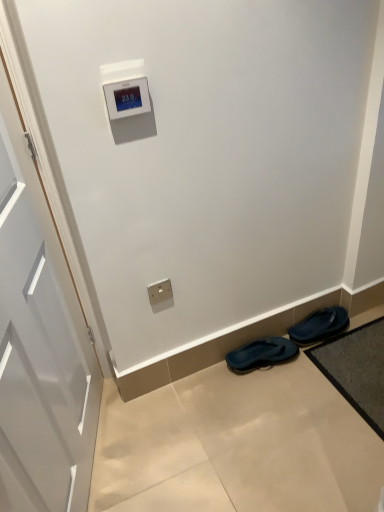
Image resolution: width=384 pixels, height=512 pixels. I want to click on free space that is in between dark gray textured bath mat at lower right and dark blue rubber flip-flops at lower right, the 1th footwear viewed from the left, so click(x=304, y=394).